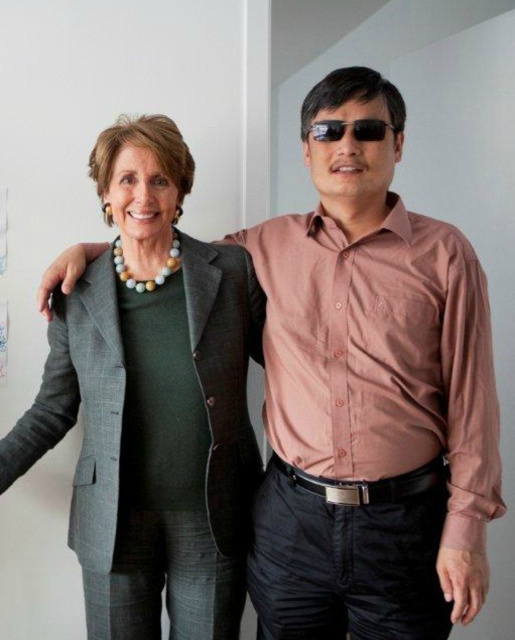
You are a photographer setting up for a portrait. You notice the matte gray blazer at center and the black plastic sunglasses at center in your frame. Which object should you adjust your focus on first to ensure it appears sharp in the final photo?

The matte gray blazer at center is closer to the viewer than the black plastic sunglasses at center, so you should focus on the matte gray blazer at center first to ensure proper sharpness.

You are trying to decide whether to place a rectangular box that is 12 inches wide on a shelf. You see the matte gray blazer at center and the black plastic sunglasses at center in the image. Based on their sizes, can the box fit between them on the shelf?

The matte gray blazer at center is wider than the black plastic sunglasses at center. Since the box is 12 inches wide, it depends on the actual width of the space between them. However, without exact measurements, we cannot confirm if the box will fit.

You are a photographer setting up a shoot with two subjects. You need to position them so that the matte gray blazer at center is visible in the frame without overlapping the black plastic sunglasses at center. Based on their current positions, is this possible?

Yes, since the matte gray blazer at center is to the left of the black plastic sunglasses at center, positioning the subjects so that the blazer remains on the left side of the frame while the sunglasses stay on the right would ensure no overlap.